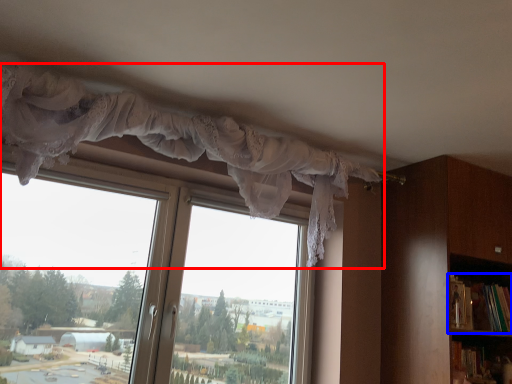
Question: Among these objects, which one is farthest to the camera, curtain (highlighted by a red box) or book (highlighted by a blue box)?

Choices:
 (A) curtain
 (B) book

Answer: (B)